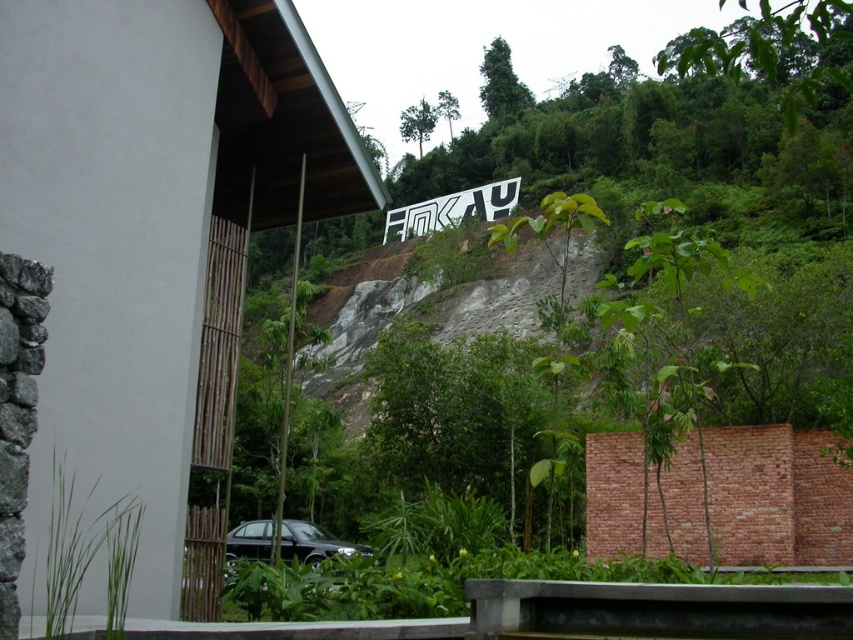
You are a photographer trying to capture the white metallic sign at upper center and the shiny black car at lower center in a single frame. Given their sizes, which object should you focus on to ensure both are clearly visible in your photo?

The white metallic sign at upper center is much taller than the shiny black car at lower center. To ensure both are clearly visible, focus on the white metallic sign at upper center as it is larger and will remain in focus while the smaller shiny black car at lower center will also be captured within the frame.

What is the object located at the coordinates point (451, 211) in the image?

The point (451, 211) indicates a white metallic sign at upper center.